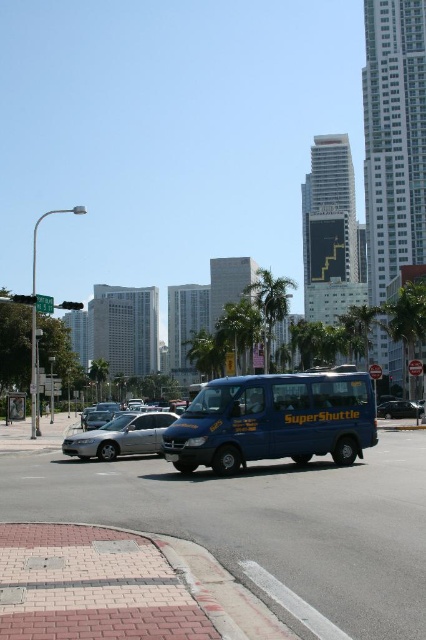
Question: Which object is positioned farthest from the silver metallic sedan at center?

Choices:
 (A) metallic blue van at center
 (B) blue matte van at center
 (C) green leafy palm tree at center

Answer: (C)

Question: Does blue matte van at center have a greater width compared to green leafy palm tree at center?

Choices:
 (A) yes
 (B) no

Answer: (B)

Question: Which point appears farthest from the camera in this image?

Choices:
 (A) coord(382,408)
 (B) coord(342,465)

Answer: (A)

Question: Is blue matte van at center to the right of metallic blue van at center from the viewer's perspective?

Choices:
 (A) yes
 (B) no

Answer: (B)

Question: Estimate the real-world distances between objects in this image. Which object is farther from the metallic blue van at center?

Choices:
 (A) green leafy palm tree at center
 (B) silver metallic sedan at center

Answer: (B)

Question: Considering the relative positions of silver metallic sedan at center and green leafy palm tree at center in the image provided, where is silver metallic sedan at center located with respect to green leafy palm tree at center?

Choices:
 (A) below
 (B) above

Answer: (A)